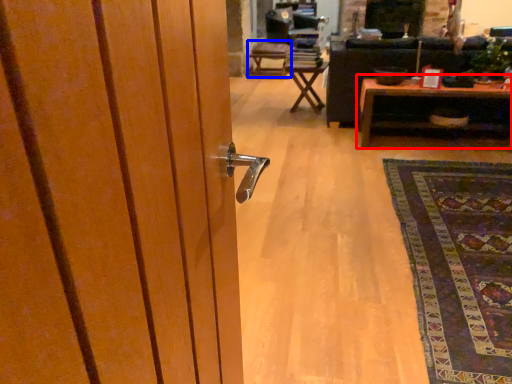
Question: Which object is closer to the camera taking this photo, table (highlighted by a red box) or chair (highlighted by a blue box)?

Choices:
 (A) table
 (B) chair

Answer: (A)